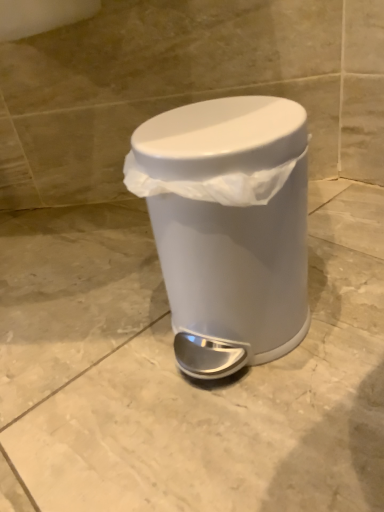
Identify the location of free spot to the right of white plastic waste container at center. (344, 287).